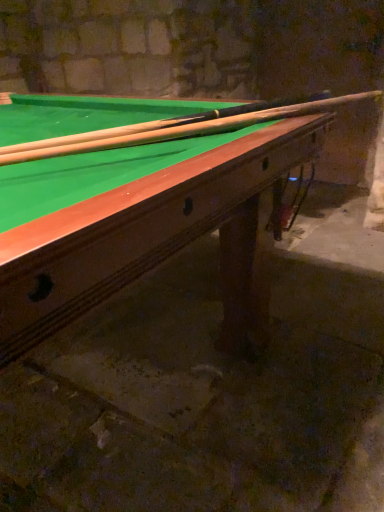
I want to click on wooden cue at upper center, so click(x=173, y=128).

Describe the element at coordinates (173, 128) in the screenshot. I see `wooden cue at upper center` at that location.

Measure the distance between point (x=73, y=129) and camera.

Point (x=73, y=129) and camera are 1.28 meters apart from each other.

In order to face green felt billiard table at upper center, should I rotate leftwards or rightwards?

It's best to rotate left around 21.267 degrees.

Describe the element at coordinates (141, 228) in the screenshot. The height and width of the screenshot is (512, 384). I see `green felt billiard table at upper center` at that location.

Locate an element on the screen. green felt billiard table at upper center is located at coordinates (141, 228).

Locate an element on the screen. The width and height of the screenshot is (384, 512). wooden cue at upper center is located at coordinates (173, 128).

Considering the positions of objects green felt billiard table at upper center and wooden cue at upper center in the image provided, who is more to the left, green felt billiard table at upper center or wooden cue at upper center?

From the viewer's perspective, green felt billiard table at upper center appears more on the left side.

Which is in front, green felt billiard table at upper center or wooden cue at upper center?

green felt billiard table at upper center.

Is point (109, 104) closer to camera compared to point (251, 111)?

No, it is not.

From the image's perspective, is green felt billiard table at upper center located beneath wooden cue at upper center?

Correct, green felt billiard table at upper center appears lower than wooden cue at upper center in the image.

From a real-world perspective, is green felt billiard table at upper center positioned above or below wooden cue at upper center?

In terms of real-world spatial position, green felt billiard table at upper center is below wooden cue at upper center.

Considering the relative sizes of green felt billiard table at upper center and wooden cue at upper center in the image provided, is green felt billiard table at upper center thinner than wooden cue at upper center?

No.

Considering the relative sizes of green felt billiard table at upper center and wooden cue at upper center in the image provided, is green felt billiard table at upper center taller than wooden cue at upper center?

Indeed, green felt billiard table at upper center has a greater height compared to wooden cue at upper center.

Is green felt billiard table at upper center bigger than wooden cue at upper center?

Correct, green felt billiard table at upper center is larger in size than wooden cue at upper center.

Is wooden cue at upper center located within green felt billiard table at upper center?

Indeed, wooden cue at upper center is located within green felt billiard table at upper center.

Is green felt billiard table at upper center next to wooden cue at upper center and touching it?

No, green felt billiard table at upper center is not in contact with wooden cue at upper center.

Is wooden cue at upper center at the back of green felt billiard table at upper center?

No, green felt billiard table at upper center is not facing away from wooden cue at upper center.

Can you tell me how much green felt billiard table at upper center and wooden cue at upper center differ in facing direction?

The facing directions of green felt billiard table at upper center and wooden cue at upper center are 62.5 degrees apart.

Locate an element on the screen. Image resolution: width=384 pixels, height=512 pixels. billiard table on the left of wooden cue at upper center is located at coordinates coord(141,228).

Visually, is wooden cue at upper center positioned to the left or to the right of green felt billiard table at upper center?

wooden cue at upper center is positioned on green felt billiard table at upper center's right side.

Between wooden cue at upper center and green felt billiard table at upper center, which one is positioned behind?

wooden cue at upper center is more distant.

Between point (226, 118) and point (103, 261), which one is positioned in front?

The point (103, 261) is in front.

From the image's perspective, does wooden cue at upper center appear lower than green felt billiard table at upper center?

Actually, wooden cue at upper center appears above green felt billiard table at upper center in the image.

From a real-world perspective, relative to green felt billiard table at upper center, is wooden cue at upper center vertically above or below?

wooden cue at upper center is above green felt billiard table at upper center.

Can you confirm if wooden cue at upper center is wider than green felt billiard table at upper center?

Incorrect, the width of wooden cue at upper center does not surpass that of green felt billiard table at upper center.

Does wooden cue at upper center have a lesser height compared to green felt billiard table at upper center?

Indeed, wooden cue at upper center has a lesser height compared to green felt billiard table at upper center.

Considering the sizes of objects wooden cue at upper center and green felt billiard table at upper center in the image provided, who is smaller, wooden cue at upper center or green felt billiard table at upper center?

wooden cue at upper center is smaller.

Do you think wooden cue at upper center is within green felt billiard table at upper center, or outside of it?

wooden cue at upper center is located inside green felt billiard table at upper center.

Is wooden cue at upper center not close to green felt billiard table at upper center?

They are positioned close to each other.

Is wooden cue at upper center looking in the opposite direction of green felt billiard table at upper center?

Yes, wooden cue at upper center's orientation is away from green felt billiard table at upper center.

How much distance is there between wooden cue at upper center and green felt billiard table at upper center?

wooden cue at upper center is 9.26 inches away from green felt billiard table at upper center.

Locate an element on the screen. The width and height of the screenshot is (384, 512). cue behind the green felt billiard table at upper center is located at coordinates (173, 128).

You are a GUI agent. You are given a task and a screenshot of the screen. Output one action in this format:
    pyautogui.click(x=<x>, y=<y>)
    Task: Click on the billiard table in front of the wooden cue at upper center
    
    Given the screenshot: What is the action you would take?
    pyautogui.click(x=141, y=228)

Image resolution: width=384 pixels, height=512 pixels. I want to click on billiard table below the wooden cue at upper center (from a real-world perspective), so click(x=141, y=228).